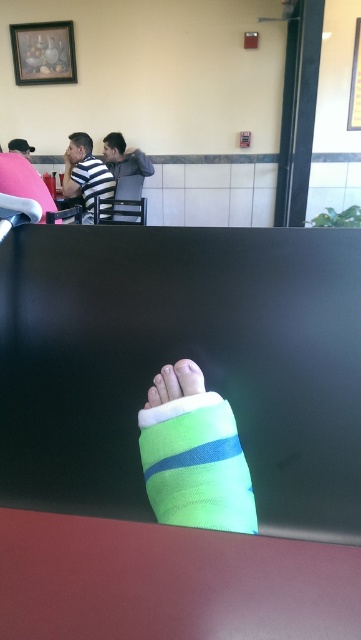
Question: Based on their relative distances, which object is farther from the green fabric bandage at center?

Choices:
 (A) green fabric sock at lower center
 (B) striped cotton shirt at upper left
 (C) striped fabric shirt at upper center

Answer: (C)

Question: Is green fabric bandage at center to the left of striped fabric shirt at upper center from the viewer's perspective?

Choices:
 (A) yes
 (B) no

Answer: (B)

Question: Which is nearer to the green fabric bandage at center?

Choices:
 (A) striped fabric shirt at upper center
 (B) green fabric sock at lower center

Answer: (B)

Question: Where is striped cotton shirt at upper left located in relation to striped fabric shirt at upper center in the image?

Choices:
 (A) left
 (B) right

Answer: (A)

Question: Which of these objects is positioned closest to the green fabric sock at lower center?

Choices:
 (A) striped fabric shirt at upper center
 (B) striped cotton shirt at upper left

Answer: (B)

Question: Is striped cotton shirt at upper left further to camera compared to green fabric bandage at center?

Choices:
 (A) yes
 (B) no

Answer: (A)